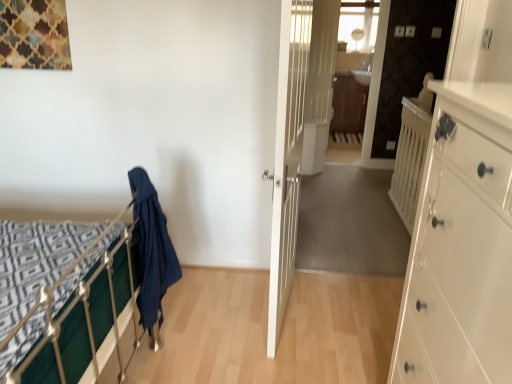
Find the location of `free spot behind white wooden balustrade at right`. free spot behind white wooden balustrade at right is located at coordinates (362, 189).